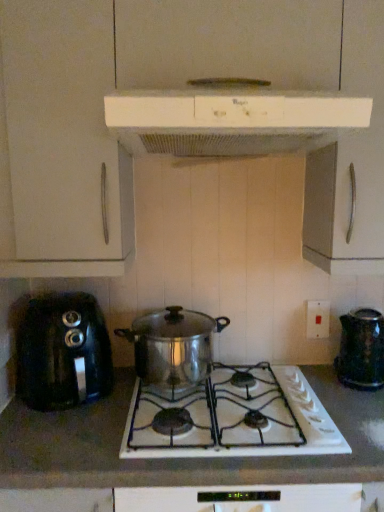
At what (x,y) coordinates should I click in order to perform the action: click on vacant space situated on the left part of shiny metallic kettle at right, marked as the fourth kitchen appliance in a left-to-right arrangement. Please return your answer as a coordinate pair (x, y). Looking at the image, I should click on (321, 380).